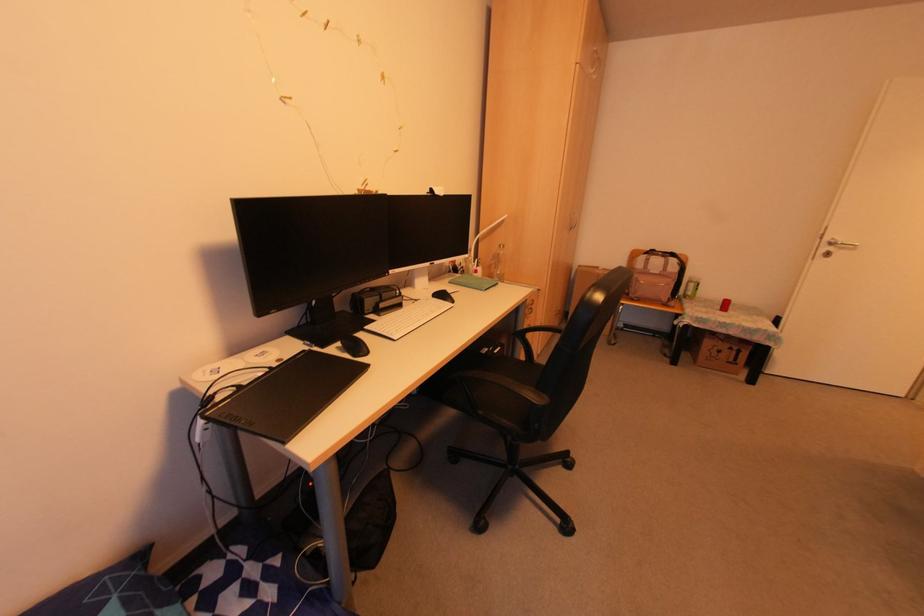
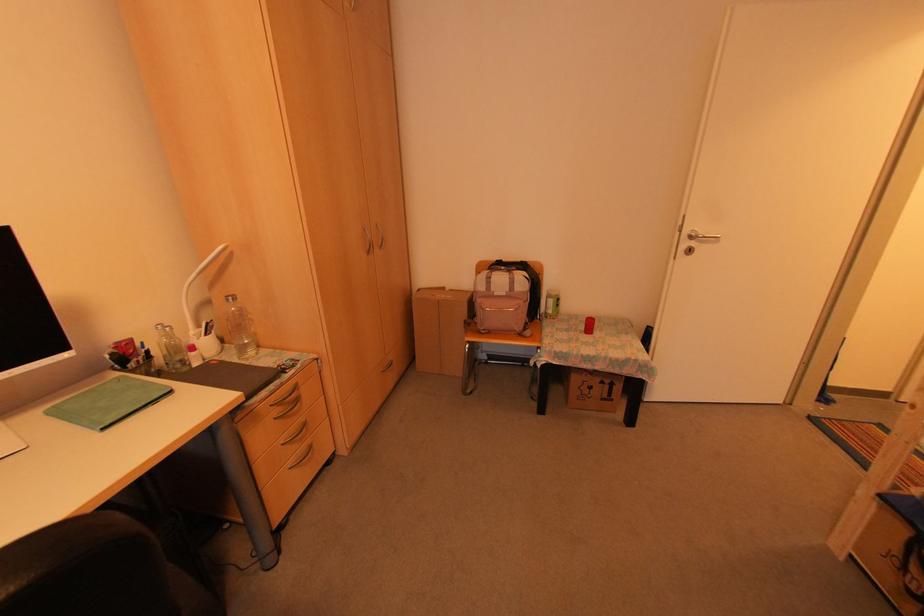
Locate, in the second image, the point that corresponds to (725,346) in the first image.

(598, 381)